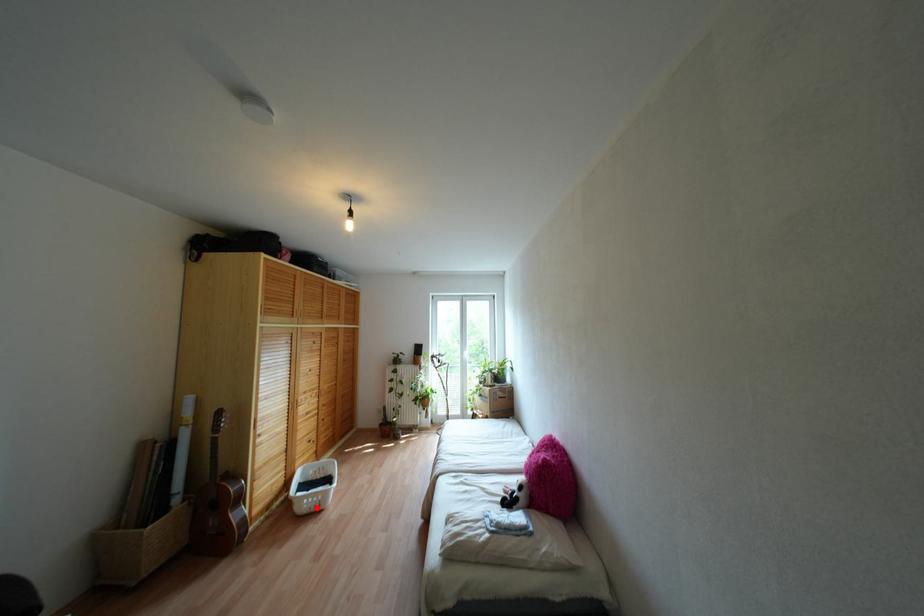
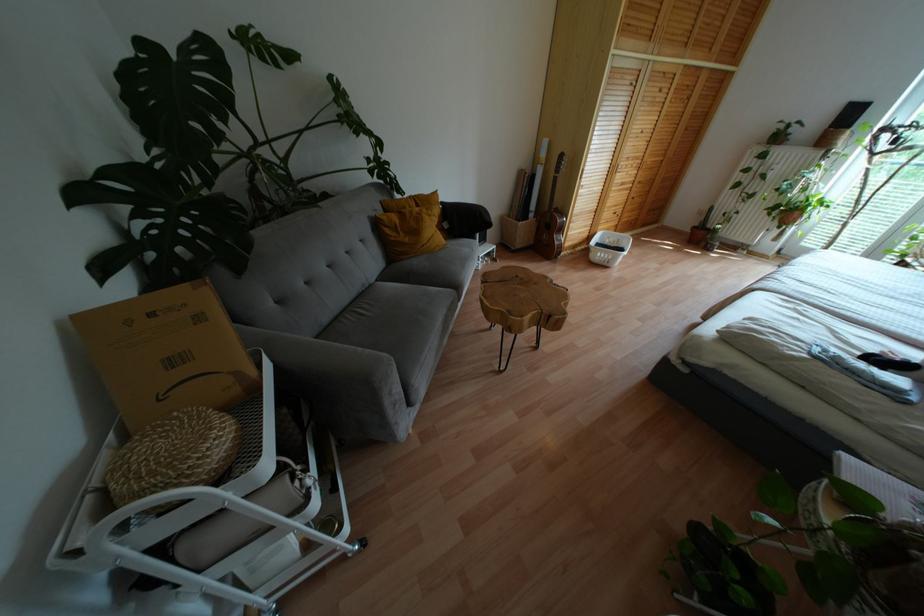
Question: I am providing you with two images of the same scene from different viewpoints. In image1, a red point is highlighted. Considering the same 3D point in image2, which of the following is correct?

Choices:
 (A) It is closer
 (B) It is farther

Answer: (A)